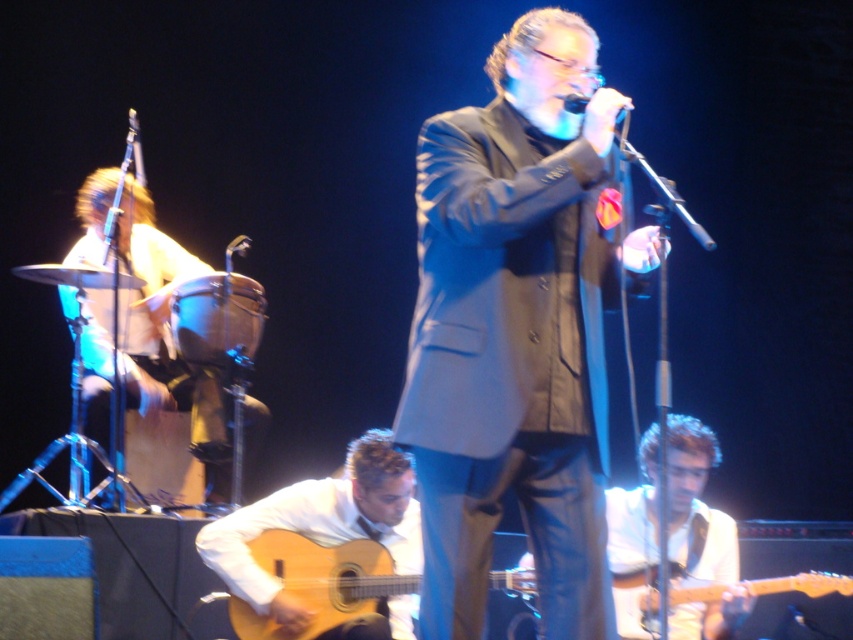
Question: Observing the image, what is the correct spatial positioning of light brown wood guitar at center in reference to metallic silver microphone at upper center?

Choices:
 (A) left
 (B) right

Answer: (B)

Question: Does black matte suit at center appear under metallic silver microphone at upper center?

Choices:
 (A) no
 (B) yes

Answer: (B)

Question: Based on their relative distances, which object is farther from the light brown drum at left?

Choices:
 (A) metallic silver microphone at upper center
 (B) light brown wood guitar at center
 (C) black matte suit at center
 (D) black matte microphone at center

Answer: (D)

Question: Which point is closer to the camera taking this photo?

Choices:
 (A) tap(575, 102)
 (B) tap(97, 260)
 (C) tap(367, 529)

Answer: (A)

Question: Can you confirm if black matte suit at center is positioned above metallic silver microphone at upper center?

Choices:
 (A) yes
 (B) no

Answer: (B)

Question: Which object is farther from the camera taking this photo?

Choices:
 (A) light brown drum at left
 (B) metallic silver microphone at upper center
 (C) black matte suit at center

Answer: (B)